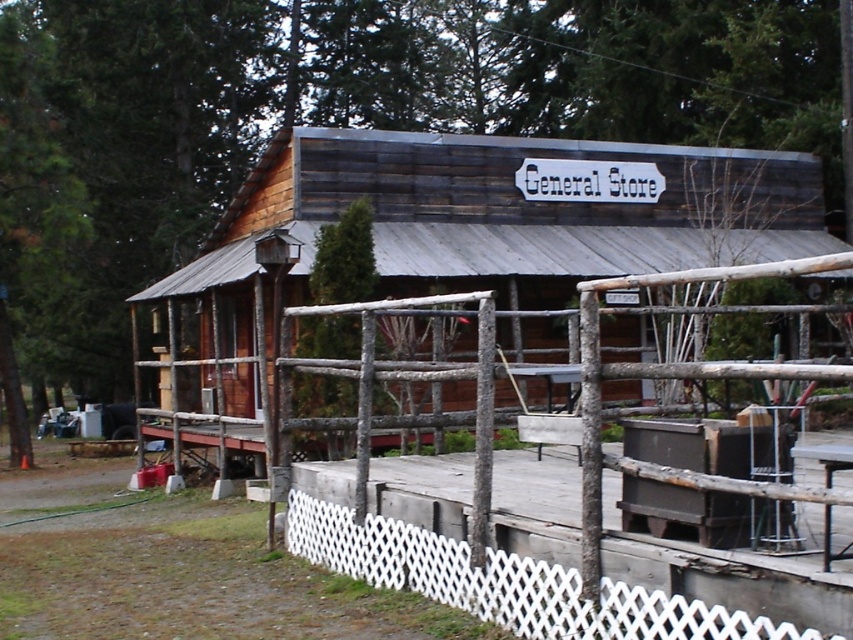
Question: Among these objects, which one is nearest to the camera?

Choices:
 (A) white lattice fence at center
 (B) white lattice fence at lower center

Answer: (A)

Question: Considering the real-world distances, which object is closest to the weathered wood cabin at center?

Choices:
 (A) white lattice fence at center
 (B) white lattice fence at lower center

Answer: (A)

Question: Is the position of weathered wood cabin at center more distant than that of white lattice fence at lower center?

Choices:
 (A) yes
 (B) no

Answer: (A)

Question: Can you confirm if white lattice fence at center is smaller than white lattice fence at lower center?

Choices:
 (A) yes
 (B) no

Answer: (B)

Question: Is weathered wood cabin at center to the left of white lattice fence at center from the viewer's perspective?

Choices:
 (A) no
 (B) yes

Answer: (A)

Question: Which point is closer to the camera taking this photo?

Choices:
 (A) (743, 616)
 (B) (683, 276)
 (C) (299, 198)

Answer: (A)